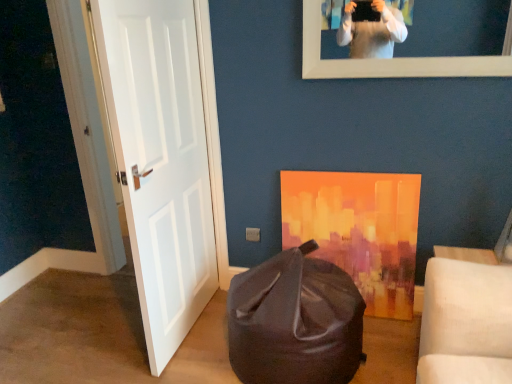
This screenshot has width=512, height=384. I want to click on free spot in front of white matte door at left, so (x=180, y=360).